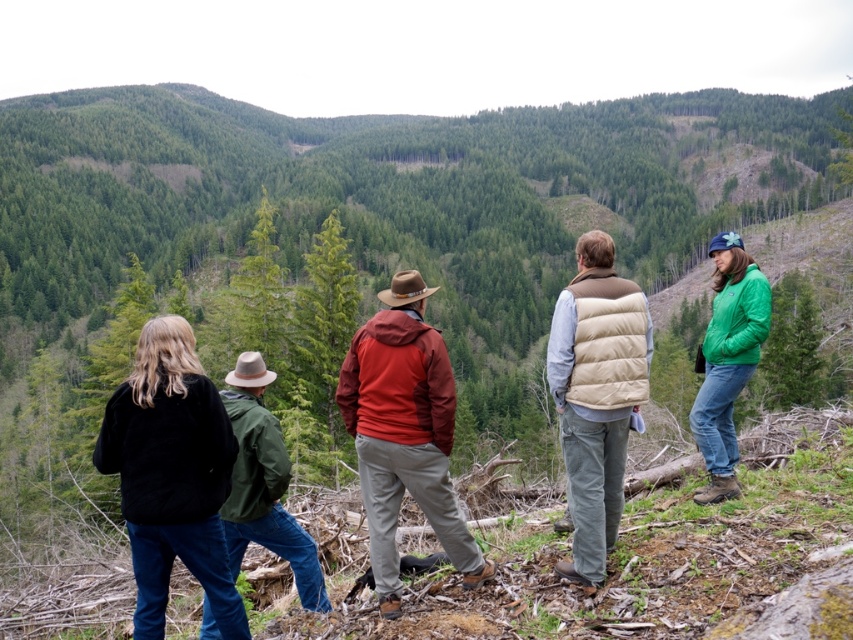
Question: Which of the following is the closest to the observer?

Choices:
 (A) beige down vest at center
 (B) green matte jacket at center-left

Answer: (A)

Question: Which of the following is the closest to the observer?

Choices:
 (A) (566, 288)
 (B) (305, 548)

Answer: (A)

Question: Is matte brown jacket at center behind green matte jacket at right?

Choices:
 (A) no
 (B) yes

Answer: (A)

Question: Which of these objects is positioned closest to the green matte jacket at right?

Choices:
 (A) green matte jacket at center-left
 (B) matte brown jacket at center
 (C) black fleece jacket at lower left
 (D) beige down vest at center

Answer: (D)

Question: Is black fleece jacket at lower left below beige down vest at center?

Choices:
 (A) yes
 (B) no

Answer: (A)

Question: In this image, where is green matte jacket at center-left located relative to green matte jacket at right?

Choices:
 (A) left
 (B) right

Answer: (A)